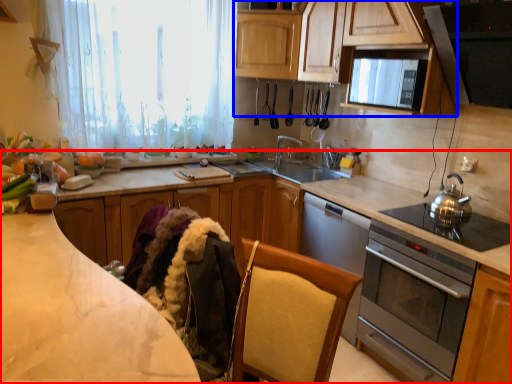
Question: Among these objects, which one is nearest to the camera, countertop (highlighted by a red box) or cabinetry (highlighted by a blue box)?

Choices:
 (A) countertop
 (B) cabinetry

Answer: (B)